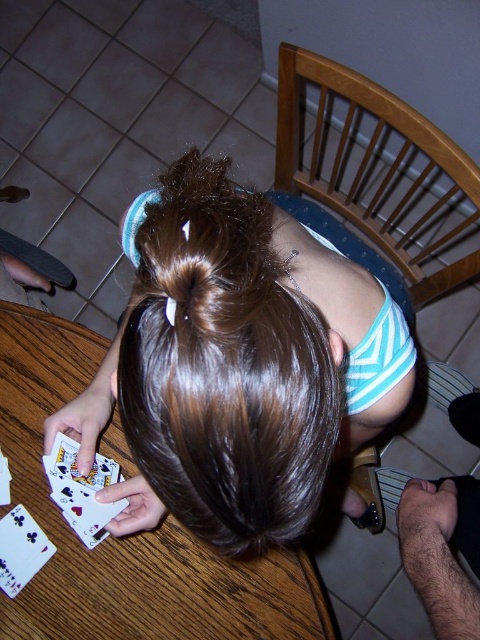
Please describe the position of the brown shiny hair at center in terms of coordinates. The scene is viewed from above. The coordinate system has the origin at the bottom left corner of the image, with the x axis pointing to the right and the y axis pointing upward. The coordinates are normalized between 0 and 1. Please answer with the exact coordinates provided in the description.

The brown shiny hair at center is located at coordinates x 0.570 and y 0.498.

You are a photographer standing at a certain distance from the table. You want to capture a closeup shot of the point at coordinates (288, 440). If your camera requires you to be within 12 inches to get a clear closeup, will you need to move closer or farther away?

The distance between the point at coordinates (288, 440) and the camera is 14.40 inches. Since the required distance for a clear closeup is within 12 inches, you need to move closer to the point at coordinates (288, 440) by approximately 2.4 inches to achieve the desired shot.

You are a photographer taking a picture of the wooden table at center. You notice the brown shiny hair at center is blocking part of the table. Is the hair above or below the table?

The brown shiny hair at center is positioned over the wooden table at center, so it is above the table.